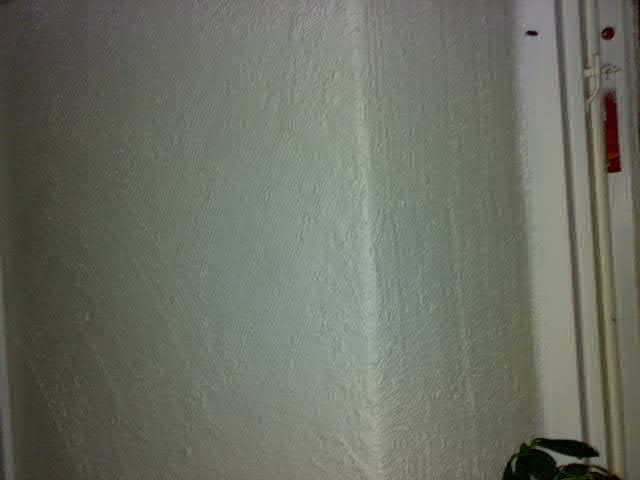
Locate an element on the screen. This screenshot has width=640, height=480. black mark on wall is located at coordinates (532, 33).